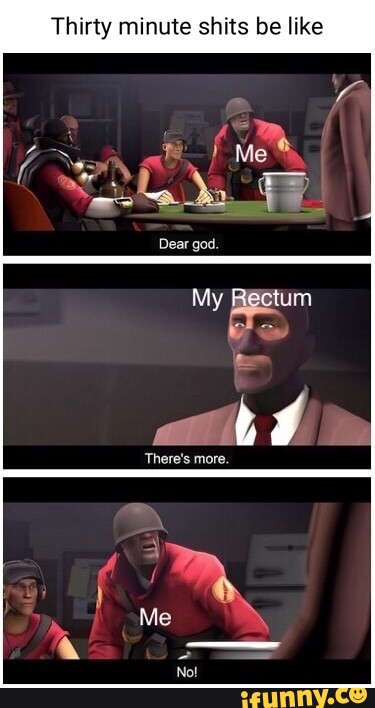
In order to click on wall in this screenshot , I will do 110,335, 219,544, 202,79.